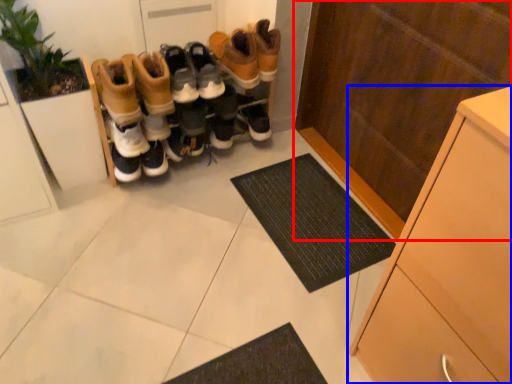
Question: Which object appears farthest to the camera in this image, cupboard (highlighted by a red box) or cabinetry (highlighted by a blue box)?

Choices:
 (A) cupboard
 (B) cabinetry

Answer: (A)